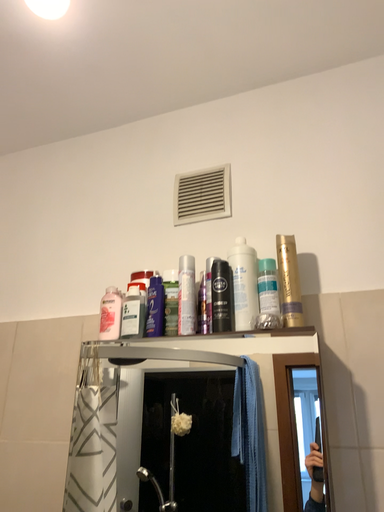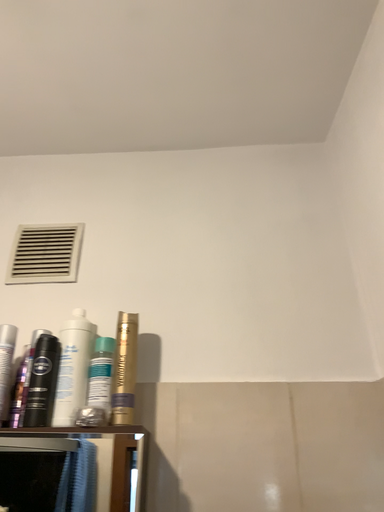
Question: Which way did the camera rotate in the video?

Choices:
 (A) rotated left
 (B) rotated right

Answer: (B)